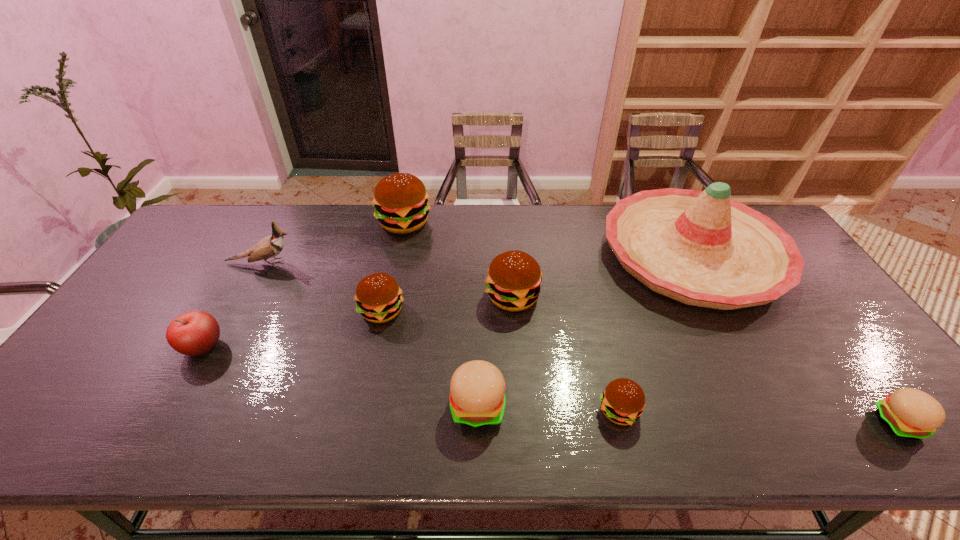
Locate an element on the screen. vacant space located on the front of the apple is located at coordinates (181, 386).

Where is `free space located 0.370m on the right of the left beige hamburger`? The width and height of the screenshot is (960, 540). free space located 0.370m on the right of the left beige hamburger is located at coordinates (665, 406).

You are a GUI agent. You are given a task and a screenshot of the screen. Output one action in this format:
    pyautogui.click(x=<x>, y=<y>)
    Task: Click on the free space located on the back of the third object from right to left
    The image size is (960, 540).
    Given the screenshot: What is the action you would take?
    pyautogui.click(x=595, y=316)

At what (x,y) coordinates should I click in order to perform the action: click on free space located 0.170m on the left of the rightmost hamburger. Please return your answer as a coordinate pair (x, y). Image resolution: width=960 pixels, height=540 pixels. Looking at the image, I should click on (802, 423).

Image resolution: width=960 pixels, height=540 pixels. What are the coordinates of `sombrero located in the far edge section of the desktop` in the screenshot? It's located at (701, 248).

At what (x,y) coordinates should I click in order to perform the action: click on hamburger positioned at the far edge. Please return your answer as a coordinate pair (x, y). Image resolution: width=960 pixels, height=540 pixels. Looking at the image, I should click on (400, 200).

Where is `sombrero that is positioned at the right edge`? sombrero that is positioned at the right edge is located at coordinates (701, 248).

This screenshot has height=540, width=960. I want to click on hamburger positioned at the right edge, so click(910, 413).

Image resolution: width=960 pixels, height=540 pixels. I want to click on object that is at the far right corner, so click(x=701, y=248).

Find the location of a particular element. object located at the near right corner is located at coordinates (910, 413).